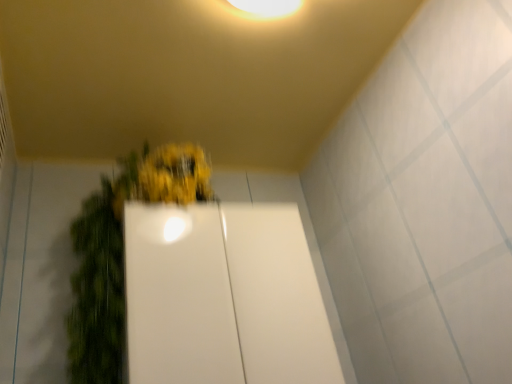
Question: Looking at their shapes, would you say white glossy door at center is wider or thinner than green matte plant at center?

Choices:
 (A) wide
 (B) thin

Answer: (B)

Question: From a real-world perspective, is white glossy door at center above or below green matte plant at center?

Choices:
 (A) below
 (B) above

Answer: (A)

Question: Is white glossy door at center taller or shorter than green matte plant at center?

Choices:
 (A) short
 (B) tall

Answer: (A)

Question: Relative to white glossy door at center, is green matte plant at center in front or behind?

Choices:
 (A) front
 (B) behind

Answer: (A)

Question: Considering the positions of green matte plant at center and white glossy door at center in the image, is green matte plant at center bigger or smaller than white glossy door at center?

Choices:
 (A) small
 (B) big

Answer: (B)

Question: From a real-world perspective, relative to white glossy door at center, is green matte plant at center vertically above or below?

Choices:
 (A) below
 (B) above

Answer: (B)

Question: Is green matte plant at center taller or shorter than white glossy door at center?

Choices:
 (A) tall
 (B) short

Answer: (A)